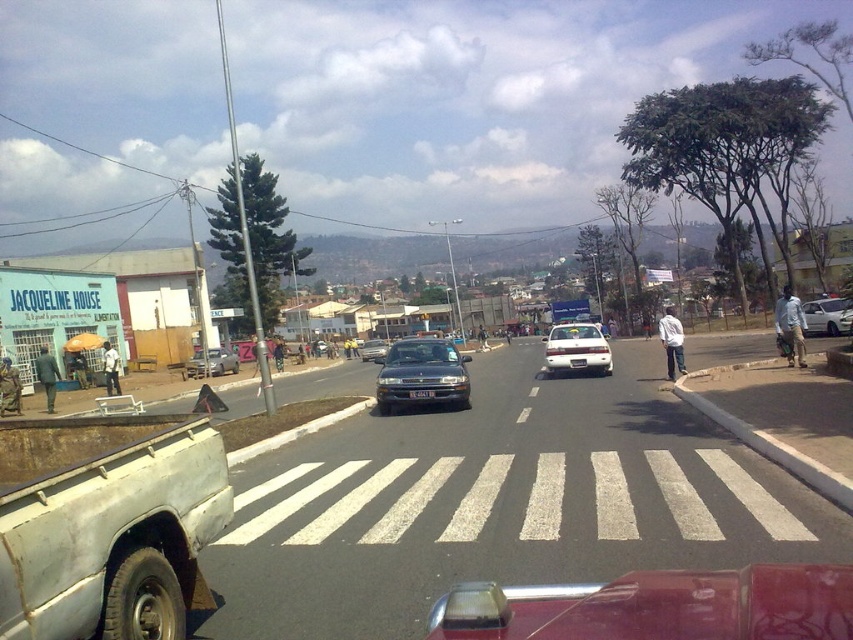
You are a pedestrian standing on the sidewalk on the left side of the road. You want to cross the street using the zebra crossing at the bottom right. There is a white matte truck at lower left represented by point (100, 512). Can you safely cross the road before the truck reaches the zebra crossing?

The white matte truck at lower left represented by point (100, 512) is located at the bottom right corner of the image, which is near the zebra crossing. Since the truck is already close to the crossing, it might obstruct your path. Wait for the truck to pass before attempting to cross.

You are standing on the sidewalk and want to cross the road using the zebra crossing. The metallic red pickup truck at lower center is blocking your path. Can you safely walk around it without stepping into the road?

The metallic red pickup truck at lower center is 3.12 meters away from you. Since the truck is blocking the path and you need to stay on the sidewalk, you cannot safely walk around it without entering the road. Wait for the truck to move or find another crossing point.

You are a pedestrian standing on the sidewalk to the left of the road. You need to cross the road using the zebra crossing. Is the metallic red pickup truck at lower center blocking your path?

The metallic red pickup truck at lower center is located at point (x=660, y=605), which is near the lower right corner of the image. Since you are on the sidewalk to the left, the truck is not directly blocking your path to the zebra crossing.